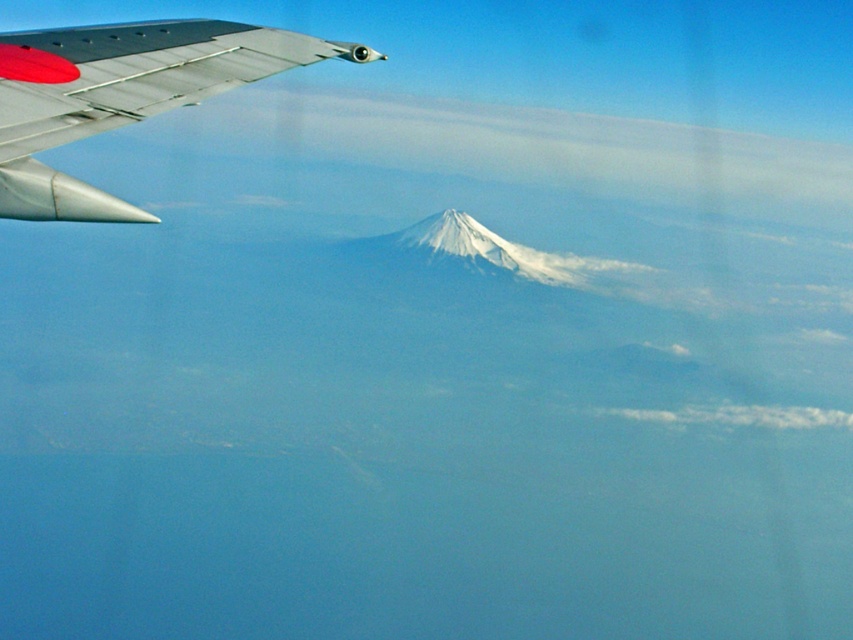
Question: Can you confirm if metallic silver winglet at upper left is thinner than white fluffy cloud at lower right?

Choices:
 (A) yes
 (B) no

Answer: (A)

Question: Is metallic silver winglet at upper left to the right of white fluffy cloud at lower right from the viewer's perspective?

Choices:
 (A) yes
 (B) no

Answer: (B)

Question: Is metallic silver winglet at upper left positioned in front of white fluffy cloud at lower right?

Choices:
 (A) no
 (B) yes

Answer: (B)

Question: Among these points, which one is farthest from the camera?

Choices:
 (A) (44, 177)
 (B) (636, 413)

Answer: (B)

Question: Which point appears closest to the camera in this image?

Choices:
 (A) (752, 406)
 (B) (270, 48)

Answer: (B)